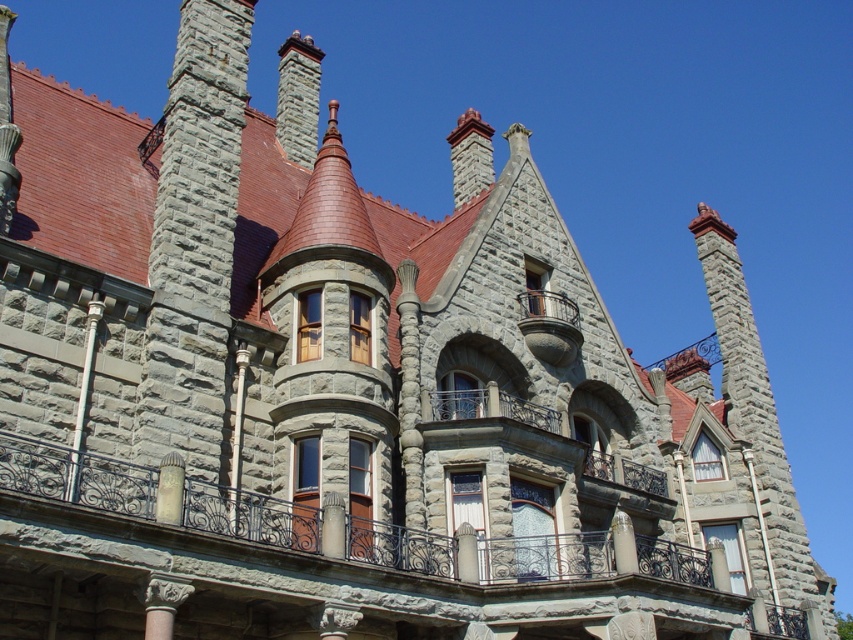
You are standing in front of the grand historic building and want to take a photo of both the gray stone chimney at left and the stone wrought iron balcony at center. Which object should you position to your left side in the camera frame to include both in the photo?

To include both the gray stone chimney at left and the stone wrought iron balcony at center in the photo, you should position the gray stone chimney at left to your left side in the camera frame since it is already located to the left of the stone wrought iron balcony at center.